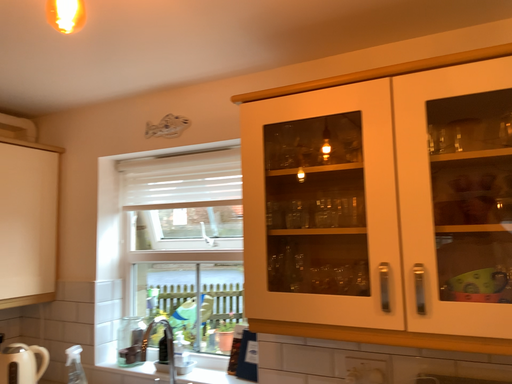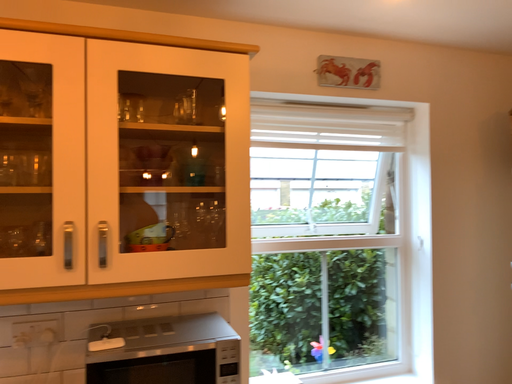
Question: How did the camera likely rotate when shooting the video?

Choices:
 (A) rotated upward
 (B) rotated downward

Answer: (B)